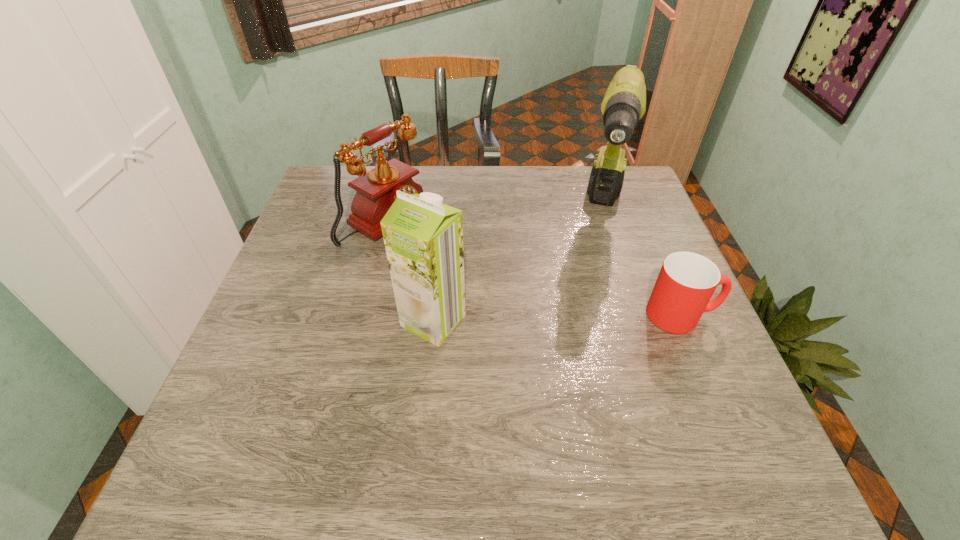
In the image, there is a desktop. Identify the location of free region at the right edge. (612, 246).

Where is `vacant area that lies between the telephone and the drill`? vacant area that lies between the telephone and the drill is located at coordinates (495, 215).

The image size is (960, 540). Find the location of `empty space that is in between the soya milk and the drill`. empty space that is in between the soya milk and the drill is located at coordinates pos(518,266).

Identify the location of free space between the shortest object and the second shortest object. This screenshot has height=540, width=960. (534, 267).

Where is `vacant region between the cup and the third tallest object`? vacant region between the cup and the third tallest object is located at coordinates (534, 267).

Where is `free space between the drill and the cup`? The height and width of the screenshot is (540, 960). free space between the drill and the cup is located at coordinates tap(642, 263).

Identify the location of empty space between the soya milk and the drill. (518, 266).

The image size is (960, 540). In order to click on unoccupied position between the cup and the drill in this screenshot , I will do point(642,263).

I want to click on vacant region between the soya milk and the drill, so click(518, 266).

Identify which object is the nearest to the soya milk. Please provide its 2D coordinates. Your answer should be formatted as a tuple, i.e. [(x, y)], where the tuple contains the x and y coordinates of a point satisfying the conditions above.

[(376, 190)]